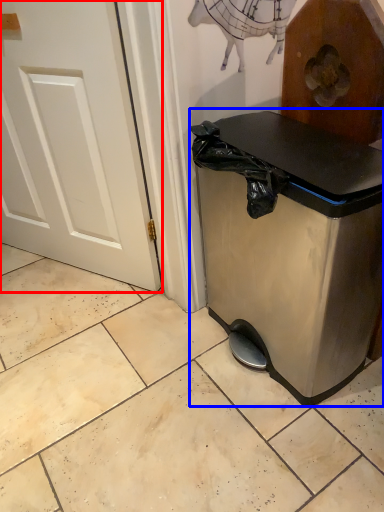
Question: Which object is closer to the camera taking this photo, door (highlighted by a red box) or waste container (highlighted by a blue box)?

Choices:
 (A) door
 (B) waste container

Answer: (B)